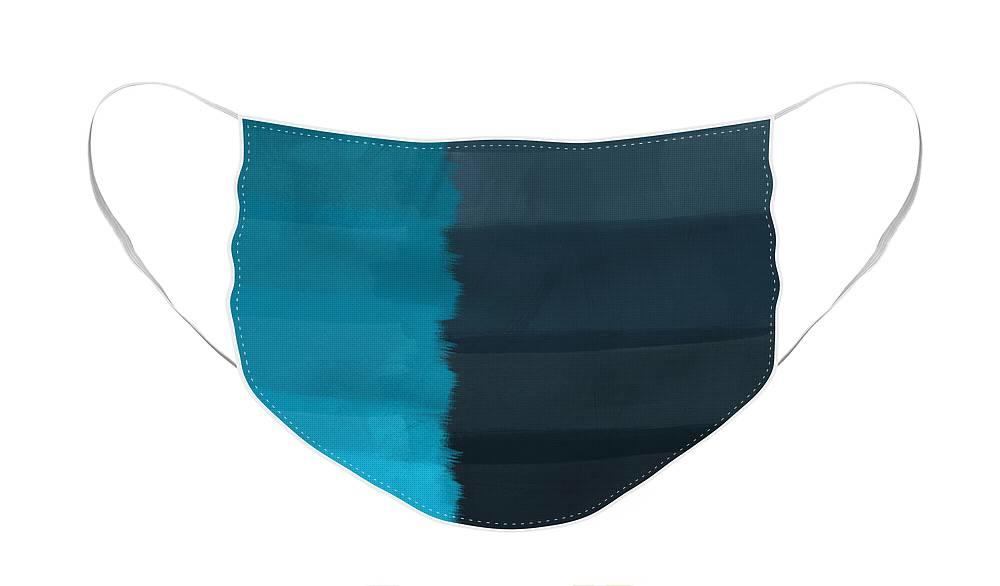
Where is `fabric pleats`? The width and height of the screenshot is (1000, 586). fabric pleats is located at coordinates (516, 223), (495, 347), (502, 459).